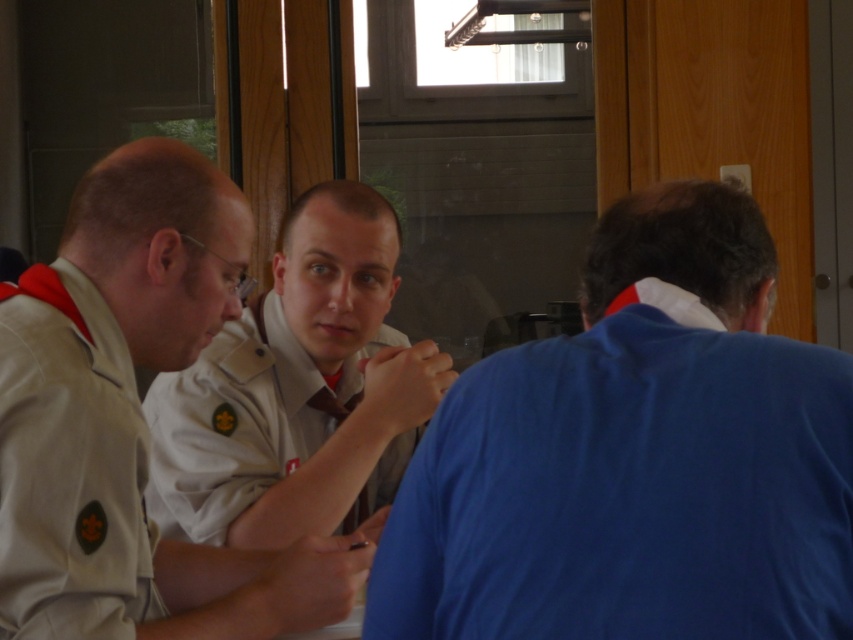
You are standing in front of the group of three individuals. You need to locate the point at coordinates (70, 467). Based on the scene description, which person is this point located on?

The point at coordinates (70, 467) is located on the tan uniform at left.

You are standing at the point labeled as point (x=599, y=458) in the image. A small robot needs to travel from your current position to the door located at the opposite end of the room. The robot has a maximum range of 1.1 meters. Can the robot reach the door from your current position without needing a recharge?

The distance between point (x=599, y=458) and the viewer is 1.13 meters. Since the robot has a maximum range of 1.1 meters, it cannot reach the door without needing a recharge.

You are standing at the entrance of the room and see a point marked at coordinates (636, 458). Which object is this point located on?

The point marked at coordinates (636, 458) is located on the blue cotton shirt at right.